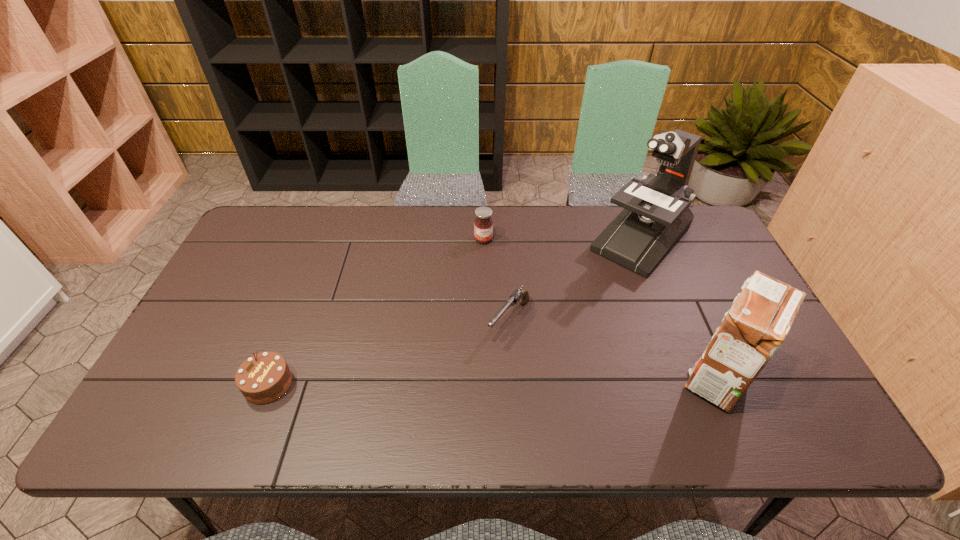
You are a GUI agent. You are given a task and a screenshot of the screen. Output one action in this format:
    pyautogui.click(x=<x>, y=<y>)
    Task: Click on the vacant spot on the desktop that is between the leftmost object and the fourth shortest object and is positioned on the label side of the jam
    
    Given the screenshot: What is the action you would take?
    coord(518,381)

Where is `vacant space on the desktop that is between the leftmost object and the second tallest object and is positioned aiming along the barrel of the gun`? The height and width of the screenshot is (540, 960). vacant space on the desktop that is between the leftmost object and the second tallest object and is positioned aiming along the barrel of the gun is located at coordinates pyautogui.click(x=459, y=382).

The height and width of the screenshot is (540, 960). Identify the location of vacant spot on the desktop that is between the leftmost object and the second tallest object and is positioned through the eyepieces of the tallest object. click(x=507, y=381).